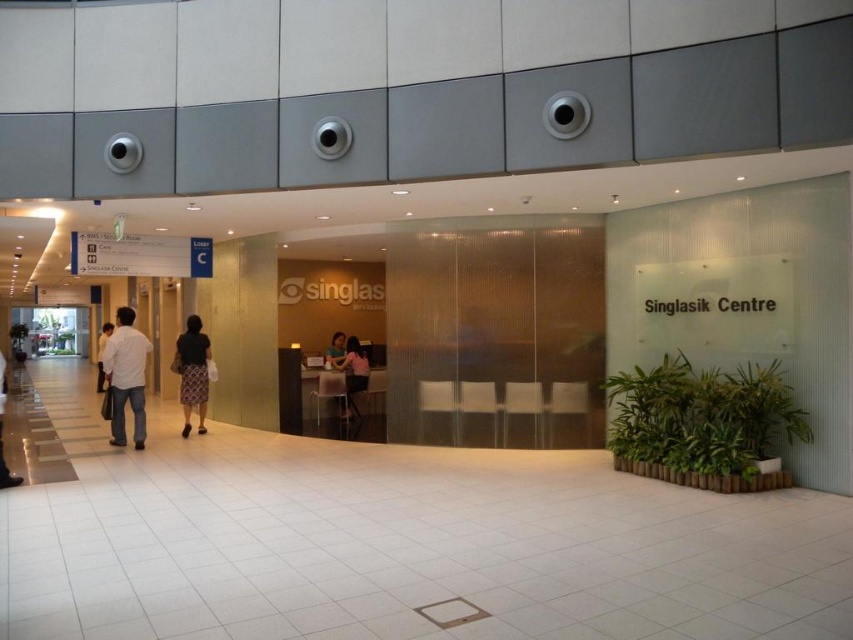
I want to click on white matte shirt at left, so click(x=126, y=376).

Can you confirm if white matte shirt at left is positioned to the right of pink fabric shirt at center?

Incorrect, white matte shirt at left is not on the right side of pink fabric shirt at center.

Measure the distance between point (109, 340) and camera.

Point (109, 340) and camera are 27.85 feet apart.

The height and width of the screenshot is (640, 853). I want to click on white matte shirt at left, so click(126, 376).

Who is positioned more to the right, pink fabric shirt at center or light beige shirt at left?

From the viewer's perspective, pink fabric shirt at center appears more on the right side.

Between point (351, 365) and point (109, 332), which one is positioned behind?

The point (109, 332) is more distant.

Find the location of a particular element. pink fabric shirt at center is located at coordinates (352, 372).

What do you see at coordinates (126, 376) in the screenshot? I see `white matte shirt at left` at bounding box center [126, 376].

Can you confirm if white matte shirt at left is positioned below light beige shirt at left?

Actually, white matte shirt at left is above light beige shirt at left.

From the picture: Measure the distance between white matte shirt at left and camera.

white matte shirt at left is 8.29 meters from camera.

I want to click on white matte shirt at left, so click(x=126, y=376).